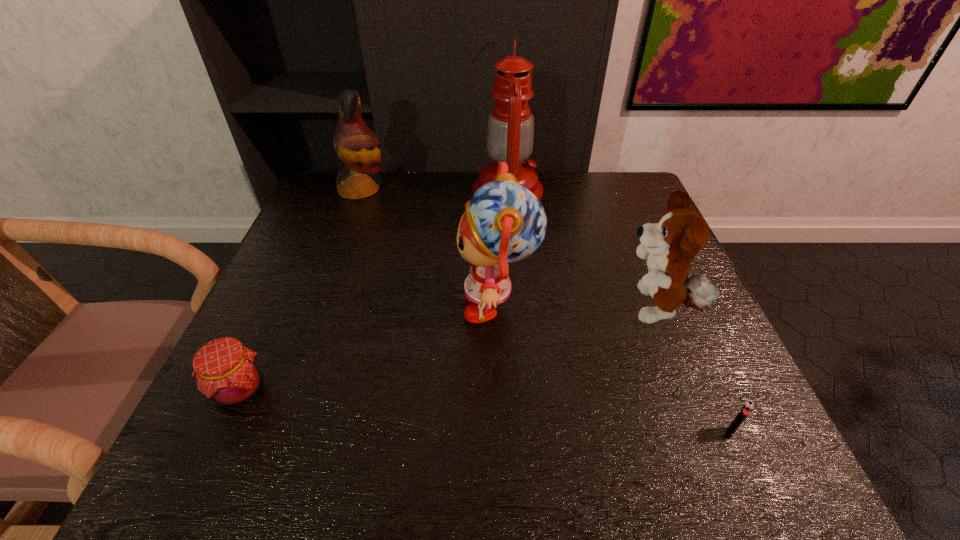
The height and width of the screenshot is (540, 960). Find the location of `vacant space at the right edge of the desktop`. vacant space at the right edge of the desktop is located at coordinates (695, 350).

The image size is (960, 540). In the image, there is a desktop. Find the location of `vacant space at the far right corner`. vacant space at the far right corner is located at coordinates (603, 181).

Where is `free space that is in between the parrot and the doll`? The image size is (960, 540). free space that is in between the parrot and the doll is located at coordinates (430, 247).

At what (x,y) coordinates should I click in order to perform the action: click on vacant area that lies between the doll and the puppy. Please return your answer as a coordinate pair (x, y). Looking at the image, I should click on (577, 308).

Image resolution: width=960 pixels, height=540 pixels. In order to click on free point between the doll and the fifth farthest object in this screenshot , I will do `click(370, 348)`.

What are the coordinates of `empty location between the parrot and the doll` in the screenshot? It's located at (430, 247).

You are a GUI agent. You are given a task and a screenshot of the screen. Output one action in this format:
    pyautogui.click(x=<x>, y=<y>)
    Task: Click on the free point between the oil lamp and the fifth tallest object
    
    Given the screenshot: What is the action you would take?
    pyautogui.click(x=374, y=291)

Locate an element on the screen. free point between the puppy and the igniter is located at coordinates (692, 372).

This screenshot has height=540, width=960. I want to click on vacant space that's between the doll and the nearest object, so click(613, 369).

Where is `free spot between the shortest object and the jam`? free spot between the shortest object and the jam is located at coordinates click(485, 411).